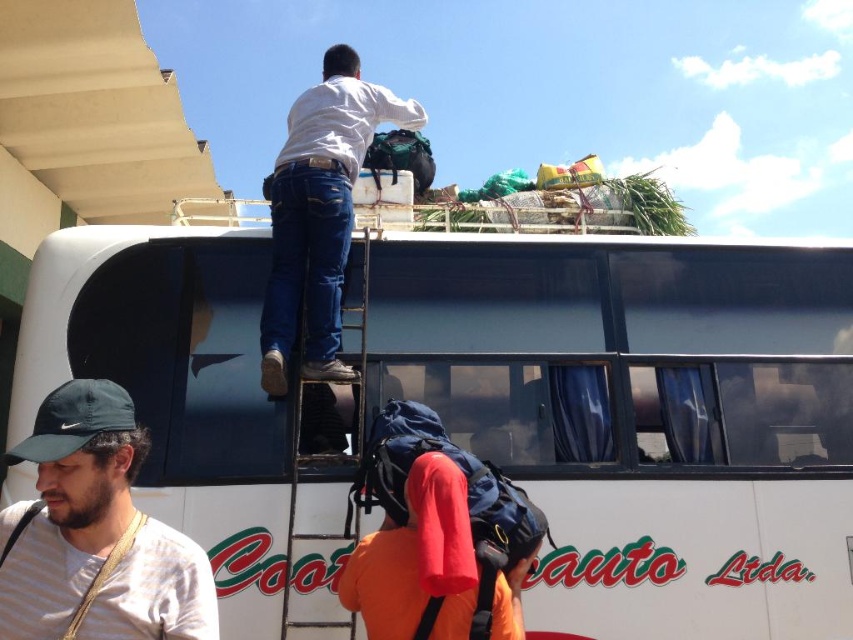
Question: Where is white matte shirt at upper center located in relation to orange fabric backpack at center in the image?

Choices:
 (A) left
 (B) right

Answer: (A)

Question: Observing the image, what is the correct spatial positioning of white matte shirt at upper center in reference to metallic silver ladder at upper center?

Choices:
 (A) left
 (B) right

Answer: (A)

Question: Where is striped cotton shirt at lower left located in relation to orange fabric backpack at center in the image?

Choices:
 (A) above
 (B) below

Answer: (A)

Question: Which of these objects is positioned farthest from the metallic silver ladder at upper center?

Choices:
 (A) striped cotton shirt at lower left
 (B) orange fabric backpack at center
 (C) white matte shirt at upper center

Answer: (A)

Question: Which of the following is the farthest from the observer?

Choices:
 (A) (310, 292)
 (B) (299, 390)
 (C) (524, 525)
 (D) (27, 545)

Answer: (A)

Question: Which object is closer to the camera taking this photo?

Choices:
 (A) white matte shirt at upper center
 (B) orange fabric backpack at center
 (C) white matte bus at upper center

Answer: (B)